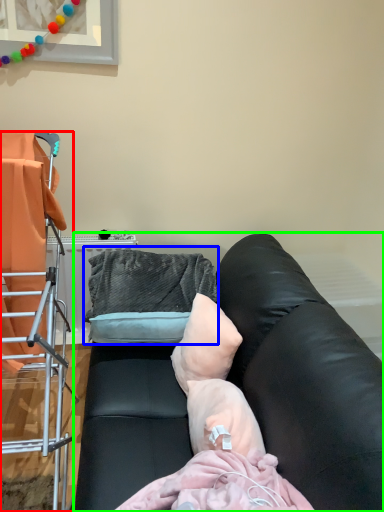
Question: Estimate the real-world distances between objects in this image. Which object is closer to furniture (highlighted by a red box), bean bag chair (highlighted by a blue box) or studio couch (highlighted by a green box)?

Choices:
 (A) bean bag chair
 (B) studio couch

Answer: (A)